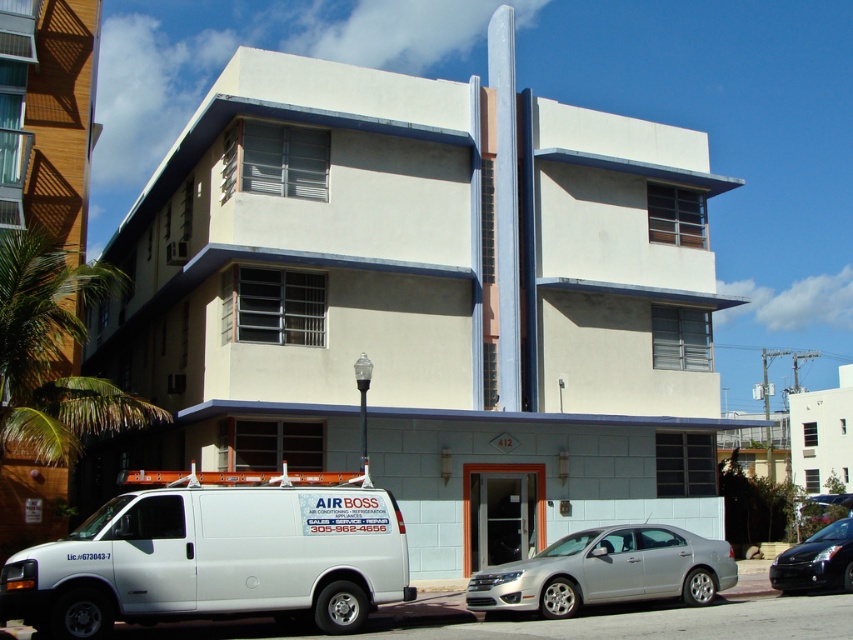
Measure the distance between white matte van at lower left and camera.

11.37 meters

Which is below, white matte van at lower left or silver metallic sedan at center?

silver metallic sedan at center is lower down.

Is point (334, 525) behind point (705, 557)?

No, it is not.

You are a GUI agent. You are given a task and a screenshot of the screen. Output one action in this format:
    pyautogui.click(x=<x>, y=<y>)
    Task: Click on the white matte van at lower left
    The width and height of the screenshot is (853, 640).
    Given the screenshot: What is the action you would take?
    pyautogui.click(x=216, y=557)

Who is lower down, silver metallic sedan at center or shiny black sedan at lower right?

shiny black sedan at lower right

Can you confirm if silver metallic sedan at center is positioned above shiny black sedan at lower right?

Correct, silver metallic sedan at center is located above shiny black sedan at lower right.

You are a GUI agent. You are given a task and a screenshot of the screen. Output one action in this format:
    pyautogui.click(x=<x>, y=<y>)
    Task: Click on the silver metallic sedan at center
    This screenshot has width=853, height=640.
    Given the screenshot: What is the action you would take?
    pyautogui.click(x=607, y=570)

Does point (323, 522) lie in front of point (828, 548)?

Yes, it is in front of point (828, 548).

Is white matte van at lower left smaller than shiny black sedan at lower right?

No, white matte van at lower left is not smaller than shiny black sedan at lower right.

This screenshot has height=640, width=853. I want to click on white matte van at lower left, so click(x=216, y=557).

The image size is (853, 640). Find the location of `white matte van at lower left`. white matte van at lower left is located at coordinates (216, 557).